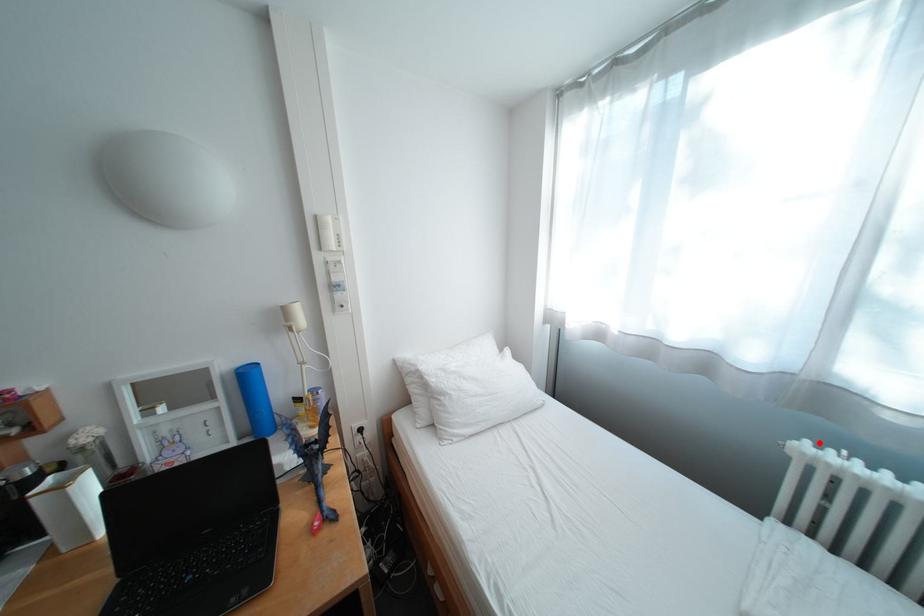
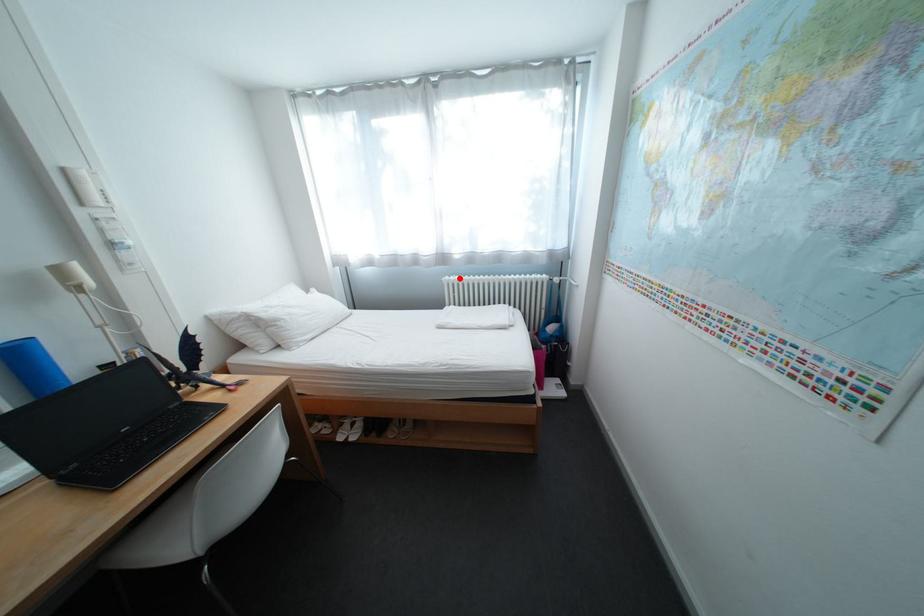
I am providing you with two images of the same scene from different viewpoints. A red point is marked on the first image and another point is marked on the second image. Is the red point in image1 aligned with the point shown in image2?

Yes